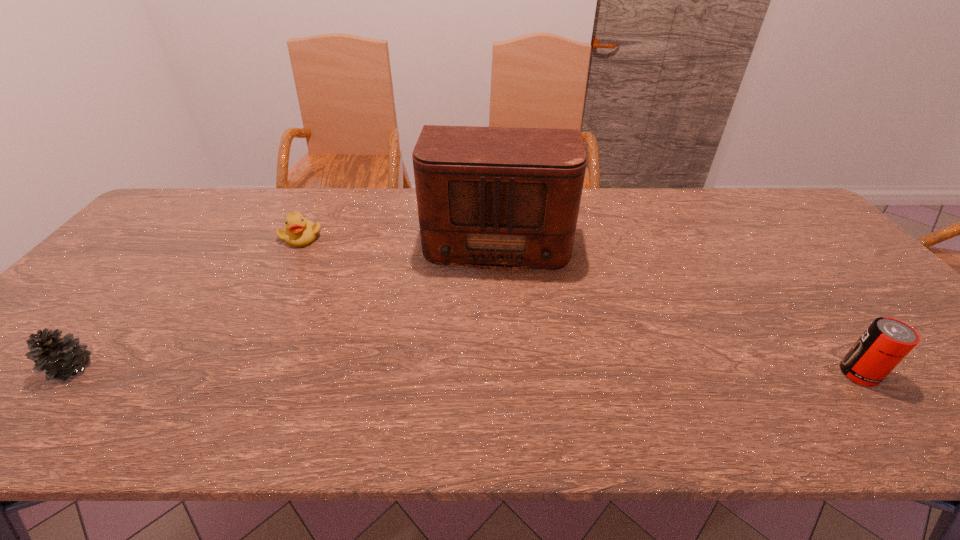
Locate an element on the screen. vacant space located on the front panel of the tallest object is located at coordinates (492, 304).

The height and width of the screenshot is (540, 960). I want to click on vacant space positioned on the front panel of the tallest object, so [x=488, y=353].

Where is `vacant space located on the front panel of the tallest object`? Image resolution: width=960 pixels, height=540 pixels. vacant space located on the front panel of the tallest object is located at coordinates (487, 367).

This screenshot has width=960, height=540. What are the coordinates of `vacant region located on the front-facing side of the duckling` in the screenshot? It's located at (321, 258).

Identify the location of vacant area located on the front-facing side of the duckling. click(362, 302).

The width and height of the screenshot is (960, 540). What are the coordinates of `vacant space situated 0.240m on the front-facing side of the duckling` in the screenshot? It's located at (348, 288).

You are a GUI agent. You are given a task and a screenshot of the screen. Output one action in this format:
    pyautogui.click(x=<x>, y=<y>)
    Task: Click on the radio receiver positioned at the far edge
    
    Given the screenshot: What is the action you would take?
    [501, 198]

The width and height of the screenshot is (960, 540). What are the coordinates of `duckling at the far edge` in the screenshot? It's located at (299, 232).

Locate an element on the screen. This screenshot has height=540, width=960. pinecone located in the near edge section of the desktop is located at coordinates (60, 358).

This screenshot has width=960, height=540. What are the coordinates of `can located at the near edge` in the screenshot? It's located at (887, 341).